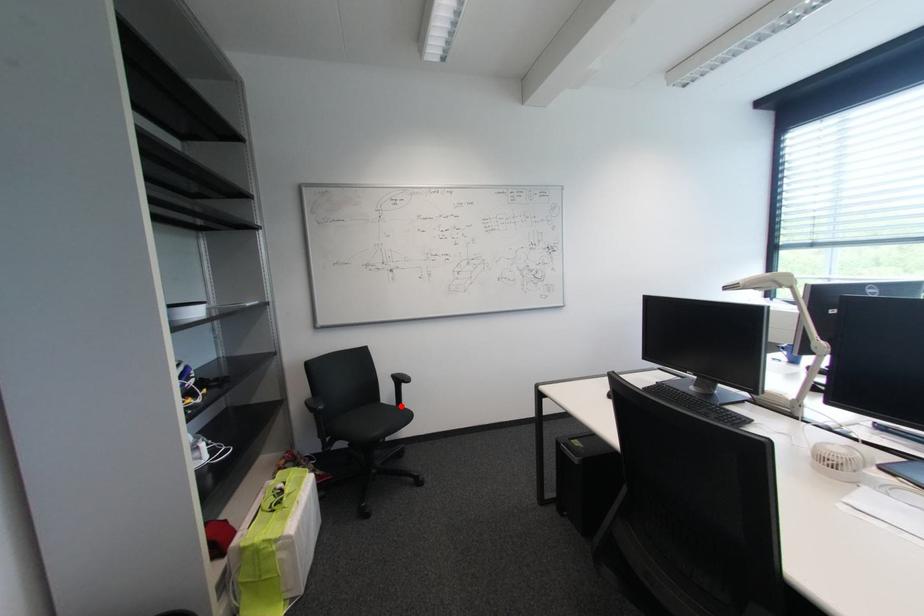
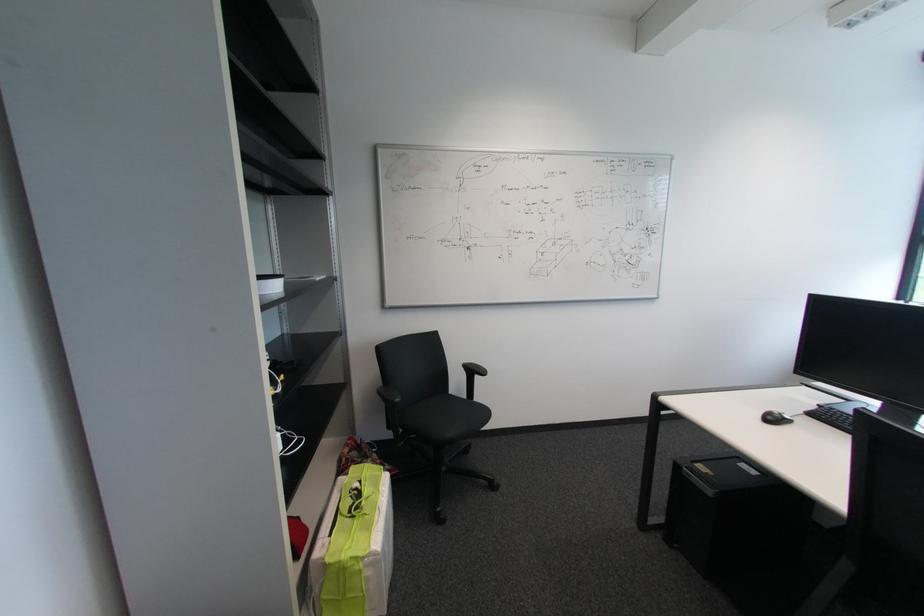
Question: I am providing you with two images of the same scene from different viewpoints. In image1, a red point is highlighted. Considering the same 3D point in image2, which of the following is correct?

Choices:
 (A) It is closer
 (B) It is farther

Answer: (A)